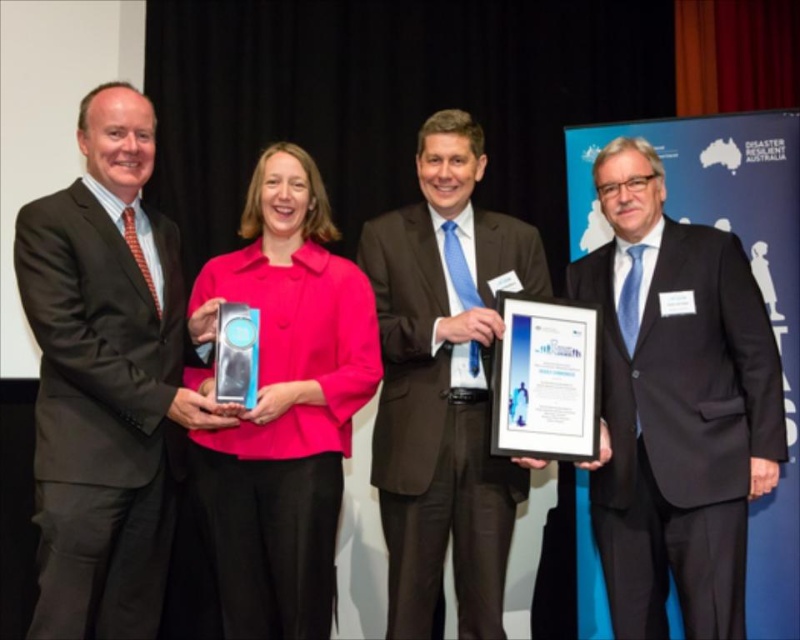
Who is positioned more to the right, matte black suit at left or black suit at center?

From the viewer's perspective, black suit at center appears more on the right side.

Is matte black suit at left further to the viewer compared to black suit at center?

That is False.

Who is more distant from viewer, (104, 115) or (664, 461)?

Point (664, 461)

Locate an element on the screen. This screenshot has width=800, height=640. matte black suit at left is located at coordinates (108, 378).

Which of these two, black suit at center or matte pink jacket at center, stands taller?

With more height is black suit at center.

Looking at this image, is black suit at center above matte pink jacket at center?

Indeed, black suit at center is positioned over matte pink jacket at center.

What do you see at coordinates (676, 404) in the screenshot?
I see `black suit at center` at bounding box center [676, 404].

This screenshot has width=800, height=640. I want to click on black suit at center, so click(676, 404).

Between matte black suit at left and matte pink jacket at center, which one is positioned higher?

matte black suit at left is higher up.

Which is more to the left, matte black suit at left or matte pink jacket at center?

matte black suit at left

Is point (88, 554) farther from viewer compared to point (332, 296)?

No, (88, 554) is in front of (332, 296).

Locate an element on the screen. matte black suit at left is located at coordinates (108, 378).